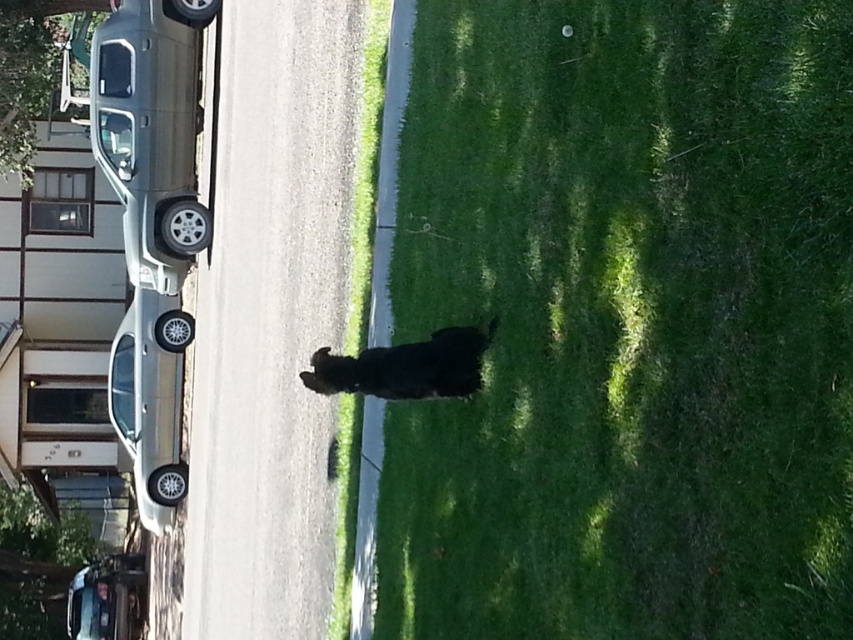
Question: Does green grass at lower right appear on the left side of metallic silver sedan at lower left?

Choices:
 (A) yes
 (B) no

Answer: (B)

Question: Can you confirm if satin silver sedan at upper left is wider than silver metallic car at left?

Choices:
 (A) yes
 (B) no

Answer: (A)

Question: Which point is farther to the camera?

Choices:
 (A) (129, 618)
 (B) (792, 545)
 (C) (166, 58)
 (D) (129, 330)

Answer: (A)

Question: Which point is closer to the camera?

Choices:
 (A) (67, 627)
 (B) (173, 483)
 (C) (146, 173)

Answer: (C)

Question: Does green grass at lower right have a greater width compared to satin silver sedan at upper left?

Choices:
 (A) no
 (B) yes

Answer: (A)

Question: Among these objects, which one is farthest from the camera?

Choices:
 (A) satin silver sedan at upper left
 (B) silver metallic car at left
 (C) green grass at lower right

Answer: (B)